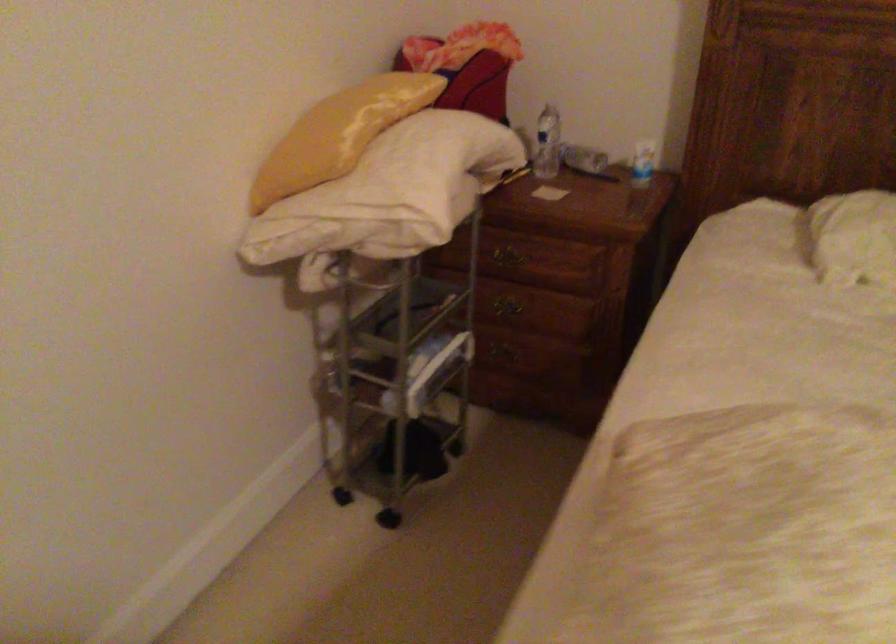
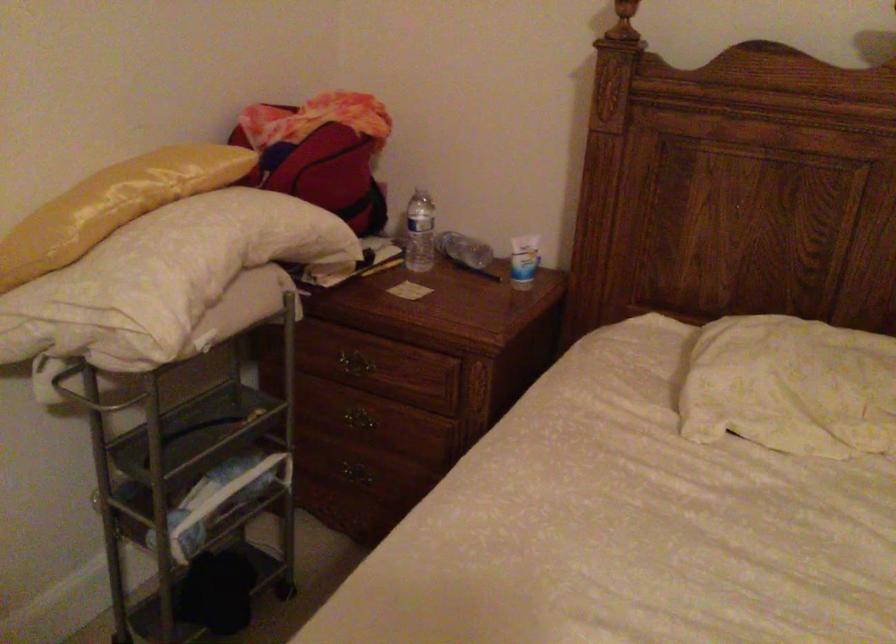
In a continuous first-person perspective shot, in which direction is the camera moving?

The movement direction of the cameraman is right, forward.